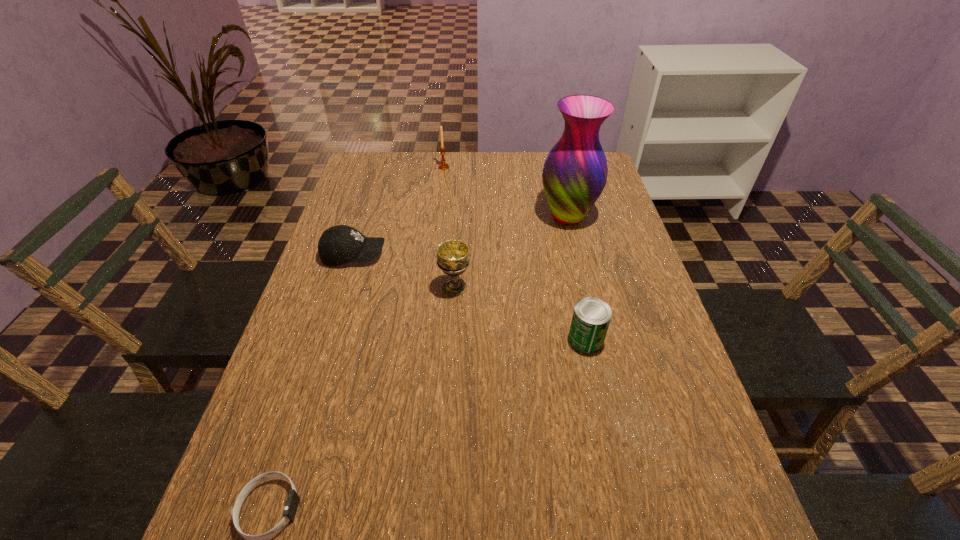
Locate an element on the screen. Image resolution: width=960 pixels, height=540 pixels. vacant space located 0.090m on the back of the third tallest object is located at coordinates (457, 254).

What are the coordinates of `vacant region located on the right of the fifth farthest object` in the screenshot? It's located at (634, 339).

The height and width of the screenshot is (540, 960). I want to click on vacant space located 0.130m on the front-facing side of the fourth nearest object, so click(x=433, y=255).

You are a GUI agent. You are given a task and a screenshot of the screen. Output one action in this format:
    pyautogui.click(x=<x>, y=<y>)
    Task: Click on the object that is positioned at the far edge
    
    Given the screenshot: What is the action you would take?
    pyautogui.click(x=443, y=166)

The height and width of the screenshot is (540, 960). Find the location of `object present at the left edge`. object present at the left edge is located at coordinates (338, 245).

Find the location of a particular element. vase at the right edge is located at coordinates (574, 175).

Locate an element on the screen. can at the right edge is located at coordinates (591, 317).

The width and height of the screenshot is (960, 540). In the image, there is a desktop. What are the coordinates of `vacant area at the far edge` in the screenshot? It's located at (517, 186).

You are a GUI agent. You are given a task and a screenshot of the screen. Output one action in this format:
    pyautogui.click(x=<x>, y=<y>)
    Task: Click on the vacant space at the left edge of the desktop
    This screenshot has width=960, height=540.
    Given the screenshot: What is the action you would take?
    pyautogui.click(x=292, y=339)

Locate an element on the screen. This screenshot has height=540, width=960. vacant area at the right edge is located at coordinates (675, 367).